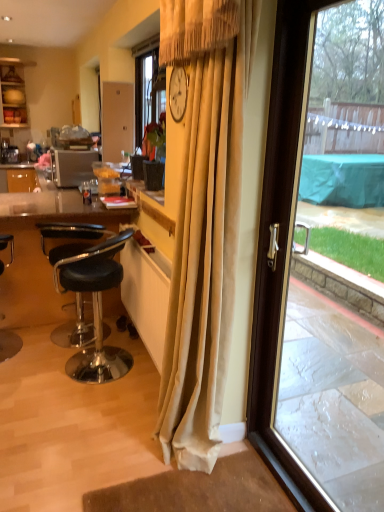
Question: From a real-world perspective, is black leather stool at lower left, the 1th chair from the left, on beige velvet curtain at center?

Choices:
 (A) no
 (B) yes

Answer: (A)

Question: Is black leather stool at lower left, which is the 2th chair from right to left, to the left of beige velvet curtain at center from the viewer's perspective?

Choices:
 (A) no
 (B) yes

Answer: (B)

Question: Considering the relative sizes of black leather stool at lower left, which is the 2th chair from right to left, and beige velvet curtain at center in the image provided, is black leather stool at lower left, which is the 2th chair from right to left, thinner than beige velvet curtain at center?

Choices:
 (A) no
 (B) yes

Answer: (A)

Question: Would you say beige velvet curtain at center is part of black leather stool at lower left, which is the 2th chair from right to left,'s contents?

Choices:
 (A) yes
 (B) no

Answer: (B)

Question: Does black leather stool at lower left, which is the 2th chair from right to left, have a lesser height compared to beige velvet curtain at center?

Choices:
 (A) yes
 (B) no

Answer: (A)

Question: From the image's perspective, is transparent glass door at right above or below black leather stool at lower left, which is the 2th chair from right to left?

Choices:
 (A) below
 (B) above

Answer: (B)

Question: In terms of width, does transparent glass door at right look wider or thinner when compared to black leather stool at lower left, the 1th chair from the left?

Choices:
 (A) thin
 (B) wide

Answer: (A)

Question: In terms of size, does transparent glass door at right appear bigger or smaller than black leather stool at lower left, which is the 2th chair from right to left?

Choices:
 (A) big
 (B) small

Answer: (A)

Question: From a real-world perspective, is transparent glass door at right positioned above or below black leather stool at lower left, which is the 2th chair from right to left?

Choices:
 (A) above
 (B) below

Answer: (A)

Question: Is transparent glass door at right taller or shorter than black leather stool at left, the 2th chair when ordered from left to right?

Choices:
 (A) tall
 (B) short

Answer: (A)

Question: Considering the relative positions of transparent glass door at right and black leather stool at left, the 2th chair when ordered from left to right, in the image provided, is transparent glass door at right to the left or to the right of black leather stool at left, the 2th chair when ordered from left to right,?

Choices:
 (A) left
 (B) right

Answer: (B)

Question: Which is correct: transparent glass door at right is inside black leather stool at left, positioned as the first chair in right-to-left order, or outside of it?

Choices:
 (A) outside
 (B) inside

Answer: (A)

Question: Relative to black leather stool at left, the 2th chair when ordered from left to right, is transparent glass door at right in front or behind?

Choices:
 (A) behind
 (B) front

Answer: (B)

Question: From a real-world perspective, is matte brown plate at upper left above or below beige velvet curtain at center?

Choices:
 (A) above
 (B) below

Answer: (A)

Question: Considering the positions of point (8, 87) and point (203, 192), is point (8, 87) closer or farther from the camera than point (203, 192)?

Choices:
 (A) closer
 (B) farther

Answer: (B)